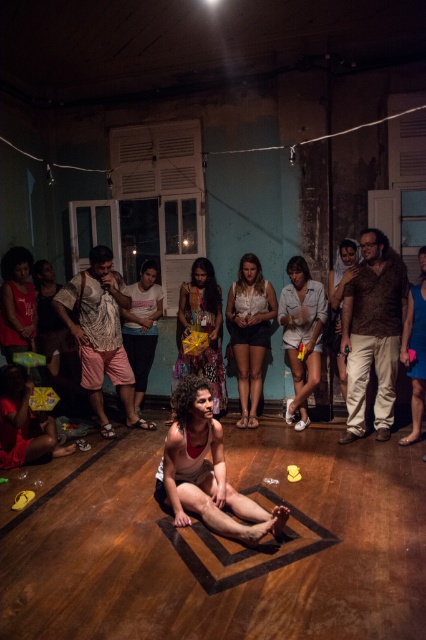
Is point (138, 396) in front of point (336, 328)?

No, (138, 396) is behind (336, 328).

Does point (135, 285) lie behind point (345, 268)?

Yes, point (135, 285) is farther from viewer.

Where is `matte white shirt at center`? This screenshot has width=426, height=640. matte white shirt at center is located at coordinates (141, 326).

Between multicolored fabric bag at center and brown textured shirt at center, which one appears on the left side from the viewer's perspective?

multicolored fabric bag at center is more to the left.

Is multicolored fabric bag at center to the left of brown textured shirt at center from the viewer's perspective?

Correct, you'll find multicolored fabric bag at center to the left of brown textured shirt at center.

Does point (213, 321) lie in front of point (334, 275)?

No, it is behind (334, 275).

Find the location of a particular element. The width and height of the screenshot is (426, 640). multicolored fabric bag at center is located at coordinates (201, 330).

Can you confirm if patterned fabric shirt at center is positioned to the left of matte white shirt at center?

Yes, patterned fabric shirt at center is to the left of matte white shirt at center.

Between patterned fabric shirt at center and matte white shirt at center, which one appears on the right side from the viewer's perspective?

matte white shirt at center

Which is behind, point (109, 371) or point (143, 282)?

The point (143, 282) is behind.

Where is `patterned fabric shirt at center`? This screenshot has width=426, height=640. patterned fabric shirt at center is located at coordinates [x=100, y=333].